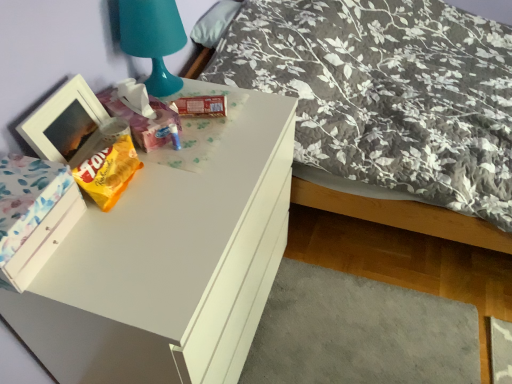
You are a GUI agent. You are given a task and a screenshot of the screen. Output one action in this format:
    pyautogui.click(x=<x>, y=<y>)
    Task: Click on the empty space that is to the right of matte plastic tissue box at upper center, the 2th package from the right
    
    Given the screenshot: What is the action you would take?
    pyautogui.click(x=214, y=135)